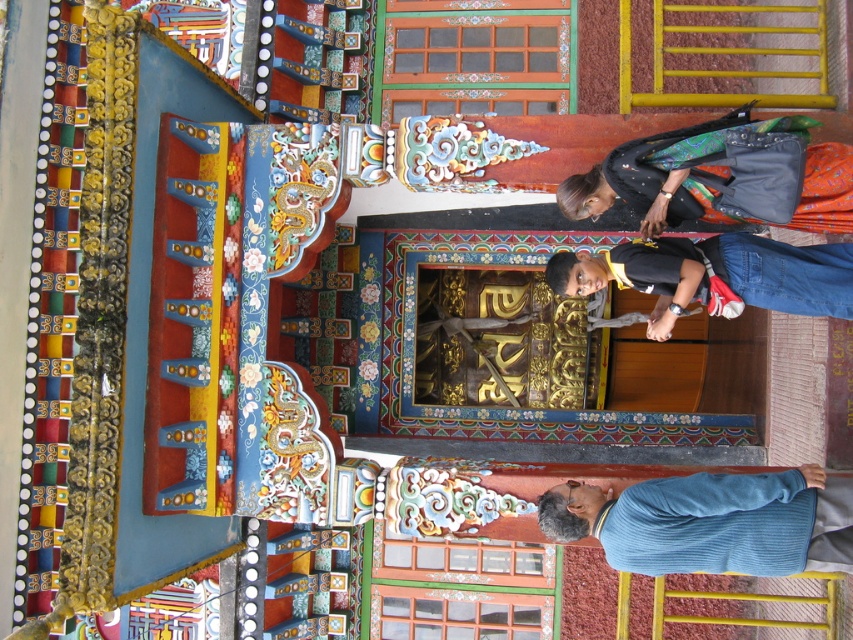
Question: Which object appears farthest from the camera in this image?

Choices:
 (A) black cotton shirt at upper right
 (B) blue corduroy sweater at lower right

Answer: (A)

Question: Does blue corduroy sweater at lower right have a smaller size compared to black cotton shirt at upper right?

Choices:
 (A) no
 (B) yes

Answer: (B)

Question: Can you confirm if blue corduroy sweater at lower right is positioned below black cotton shirt at upper right?

Choices:
 (A) no
 (B) yes

Answer: (B)

Question: From the image, what is the correct spatial relationship of blue corduroy sweater at lower right in relation to black cotton shirt at upper right?

Choices:
 (A) left
 (B) right

Answer: (B)

Question: Which of the following is the farthest from the observer?

Choices:
 (A) black cotton shirt at upper right
 (B) blue corduroy sweater at lower right

Answer: (A)